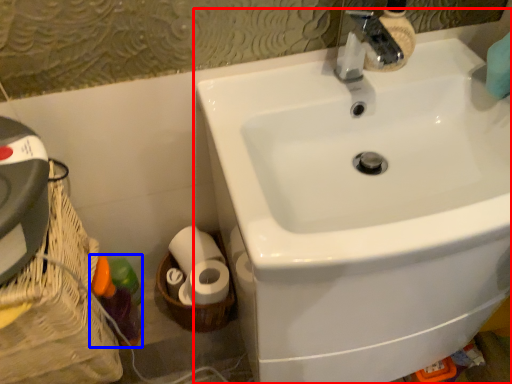
Question: Which object is closer to the camera taking this photo, sink (highlighted by a red box) or bottle (highlighted by a blue box)?

Choices:
 (A) sink
 (B) bottle

Answer: (A)